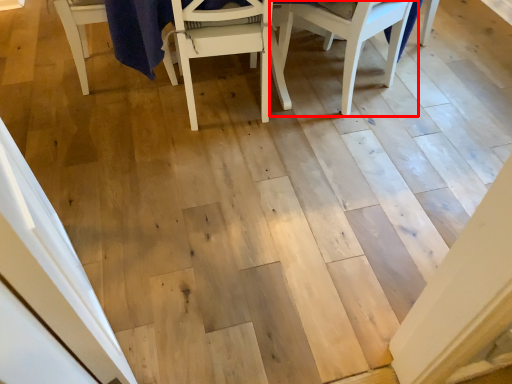
Question: Where is chair (annotated by the red box) located in relation to chair in the image?

Choices:
 (A) right
 (B) left

Answer: (A)